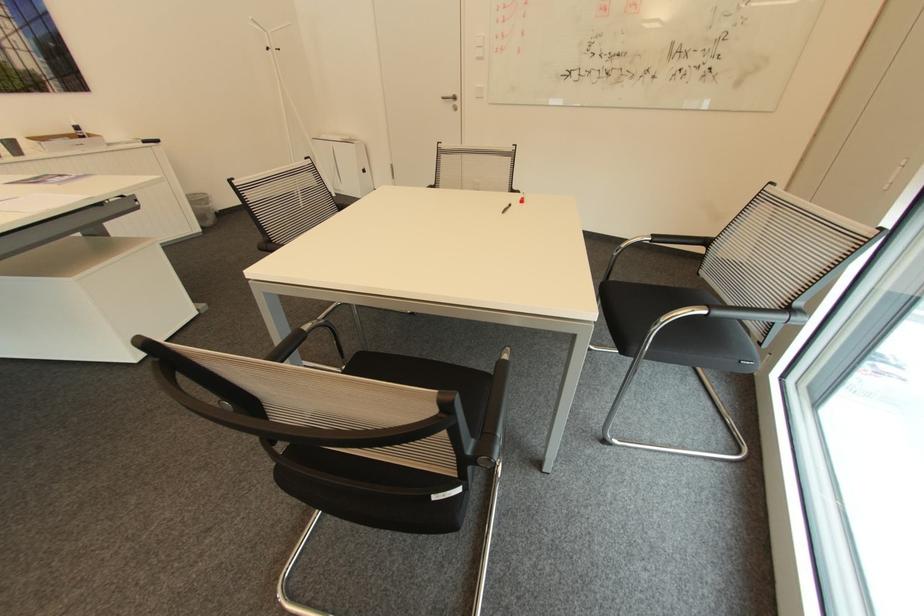
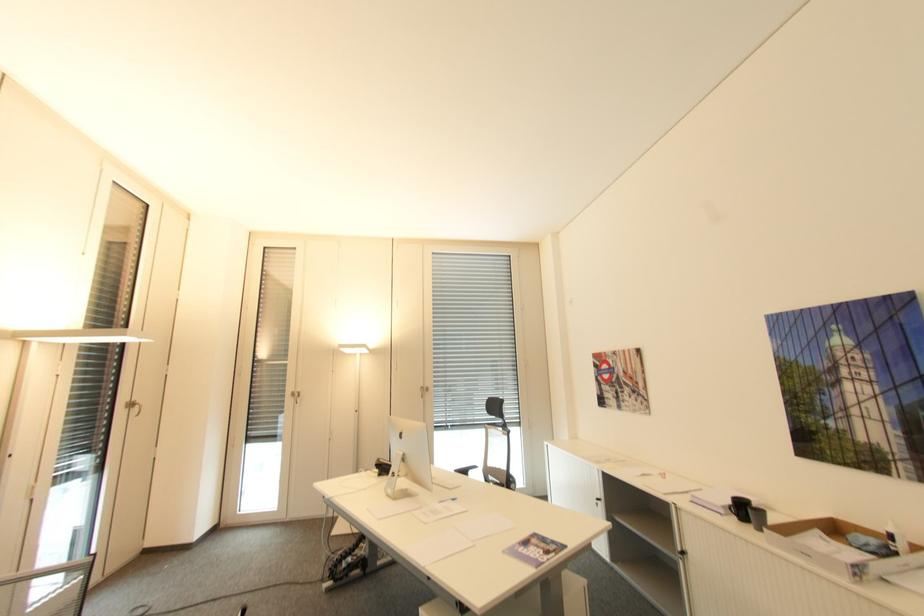
Where in the second image is the point corresponding to point 81,128 from the first image?

(895, 537)